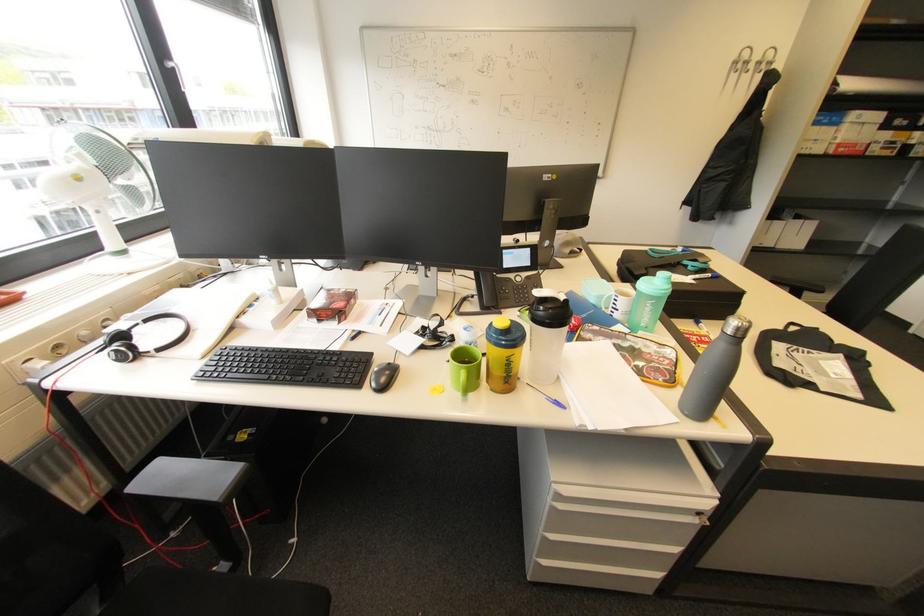
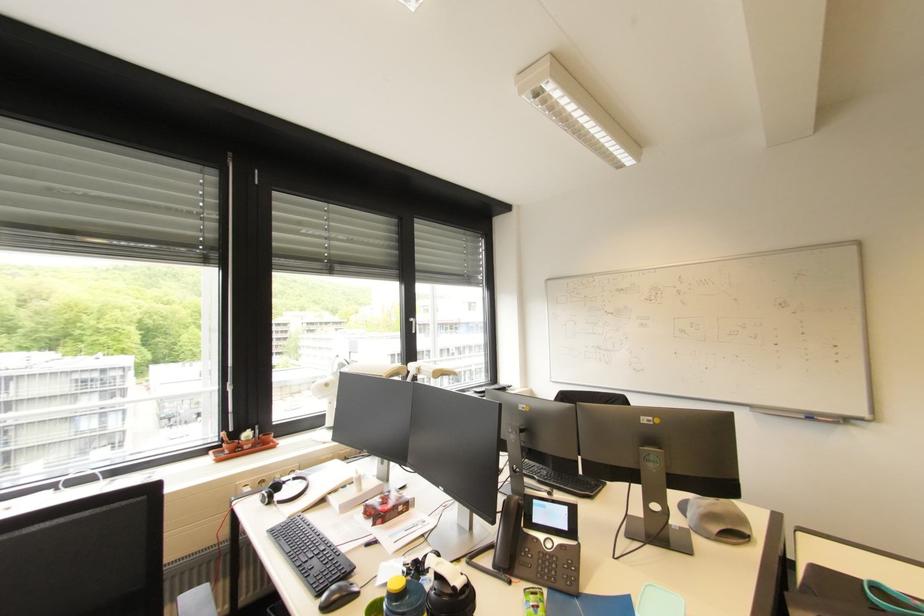
Find the pixel in the second image that matches the point at 387,389 in the first image.

(332, 609)